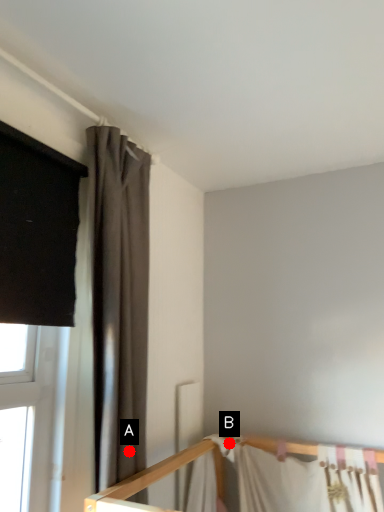
Question: Two points are circled on the image, labeled by A and B beside each circle. Among these points, which one is farthest from the camera?

Choices:
 (A) A is further
 (B) B is further

Answer: (B)